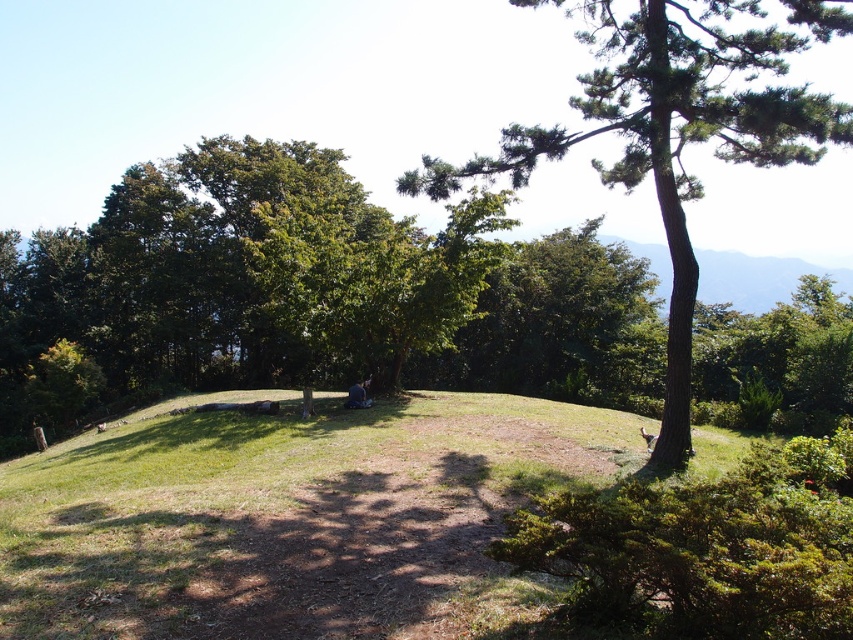
Who is positioned more to the left, green textured tree at center or blue denim jeans at center?

blue denim jeans at center

Describe the element at coordinates (676, 129) in the screenshot. Image resolution: width=853 pixels, height=640 pixels. I see `green textured tree at center` at that location.

Identify the location of green textured tree at center. The image size is (853, 640). pos(676,129).